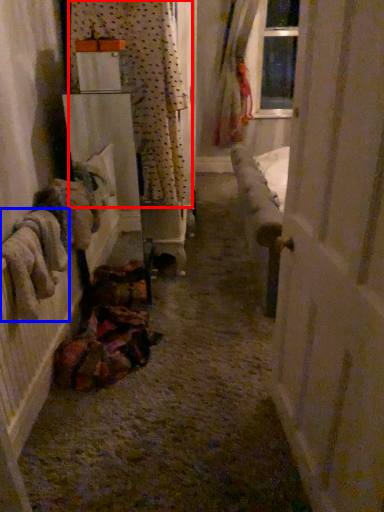
Question: Among these objects, which one is nearest to the camera, curtain (highlighted by a red box) or clothing (highlighted by a blue box)?

Choices:
 (A) curtain
 (B) clothing

Answer: (B)